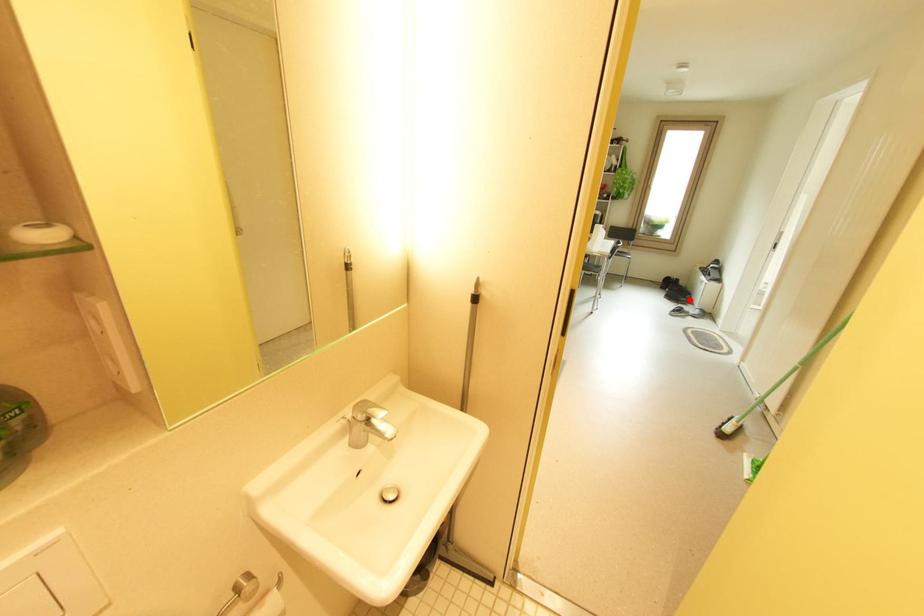
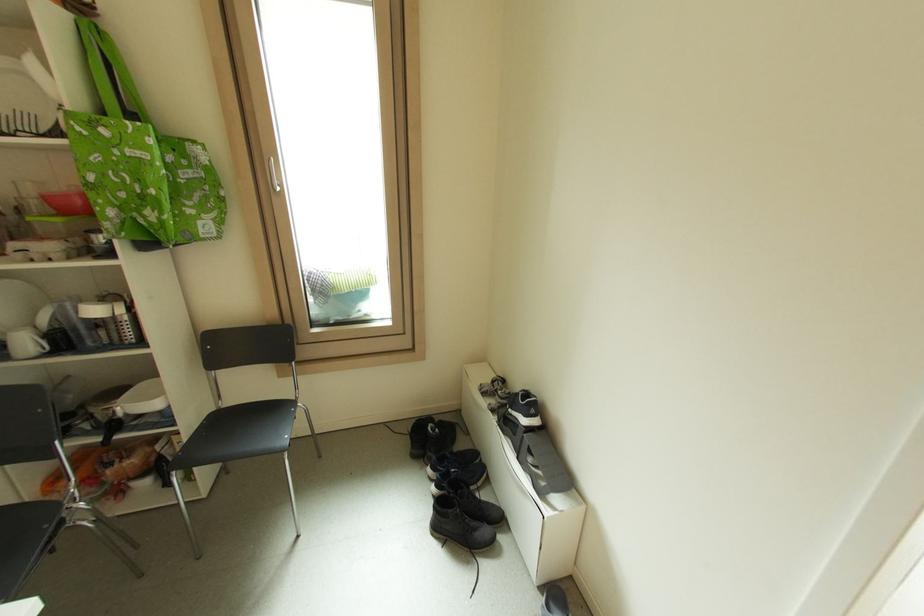
Where in the second image is the point corresponding to the highlighted location from the first image?

(490, 532)